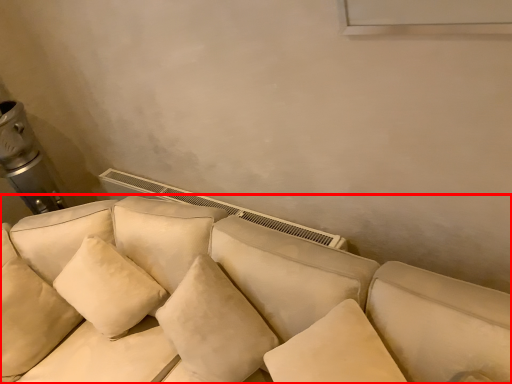
Question: From the image's perspective, what is the correct spatial positioning of studio couch (annotated by the red box) in reference to pillow?

Choices:
 (A) above
 (B) below

Answer: (B)